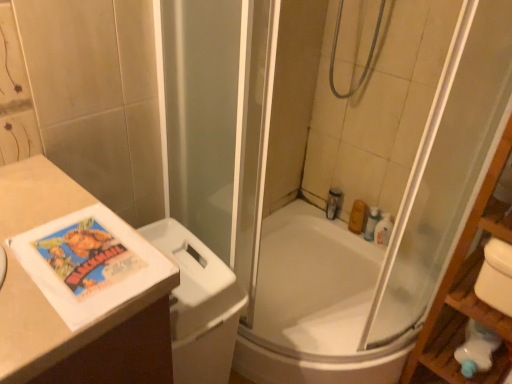
Question: From their relative heights in the image, would you say white plastic bottle at upper right, the 2th toiletry when ordered from right to left, is taller or shorter than white plastic toilet bowl at left?

Choices:
 (A) tall
 (B) short

Answer: (B)

Question: From a real-world perspective, relative to white plastic toilet bowl at left, is white plastic bottle at upper right, the 2th toiletry when ordered from right to left, vertically above or below?

Choices:
 (A) above
 (B) below

Answer: (B)

Question: Estimate the real-world distances between objects in this image. Which object is farther from the white plastic bottle at upper right, the 2th toiletry when ordered from right to left?

Choices:
 (A) orange matte soap at upper right, which appears as the third toiletry when viewed from the right
 (B) white glossy bathtub at center
 (C) wooden shelf at right
 (D) metallic silver toiletry at upper right, the first toiletry positioned from the left
 (E) translucent plastic soap at upper right, placed as the fourth toiletry when sorted from left to right

Answer: (C)

Question: Estimate the real-world distances between objects in this image. Which object is farther from the orange matte soap at upper right, which appears as the third toiletry when viewed from the right?

Choices:
 (A) white plastic toilet bowl at left
 (B) metallic silver toiletry at upper right, the first toiletry positioned from the left
 (C) wooden shelf at right
 (D) white glossy bathtub at center
 (E) white plastic bottle at upper right, the 2th toiletry when ordered from right to left

Answer: (A)